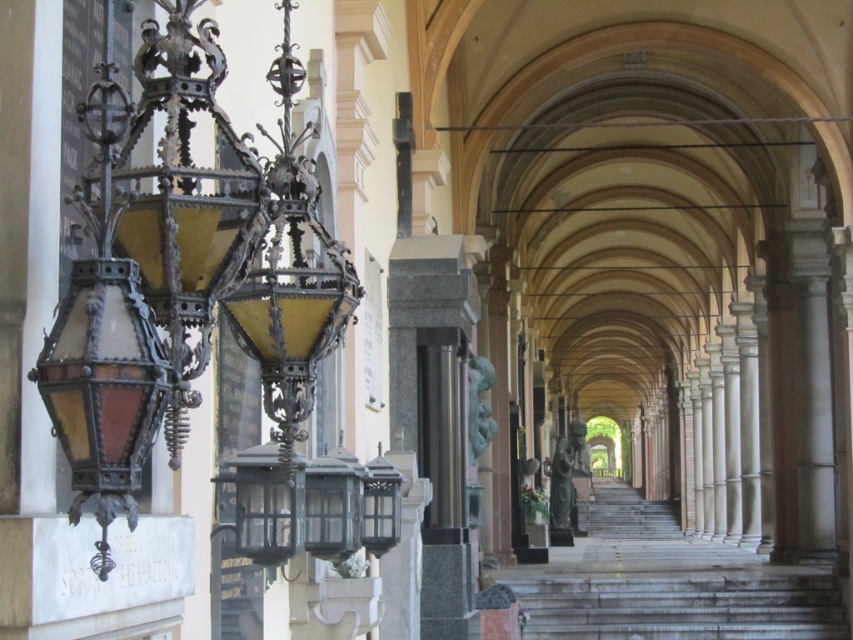
You are standing at the entrance of the corridor and see the white marble stairs at lower center and the bronze statue at center. Which object is positioned to the right of the other?

The white marble stairs at lower center are to the right of the bronze statue at center.

You are standing at the entrance of the corridor and want to go to the white marble stairs at lower center. Which direction should you walk? The corridor has a series of ornate lanterns on the left side.

You should walk forward towards the white marble stairs at lower center as they are located at point (679, 604), which is ahead in the corridor.

Based on the photo, you are standing at the entrance of the corridor and want to reach the bronze statue at center. There is a white marble stairs at lower center in your path. Can you walk around the stairs to reach the statue?

The white marble stairs at lower center occupies less space than the bronze statue at center, so yes, you can walk around the stairs to reach the bronze statue at center.